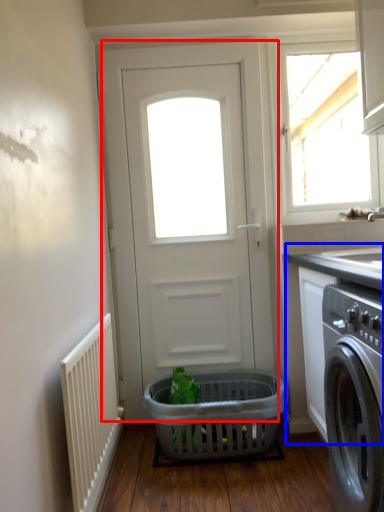
Question: Which object appears closest to the camera in this image, door (highlighted by a red box) or counter top (highlighted by a blue box)?

Choices:
 (A) door
 (B) counter top

Answer: (B)